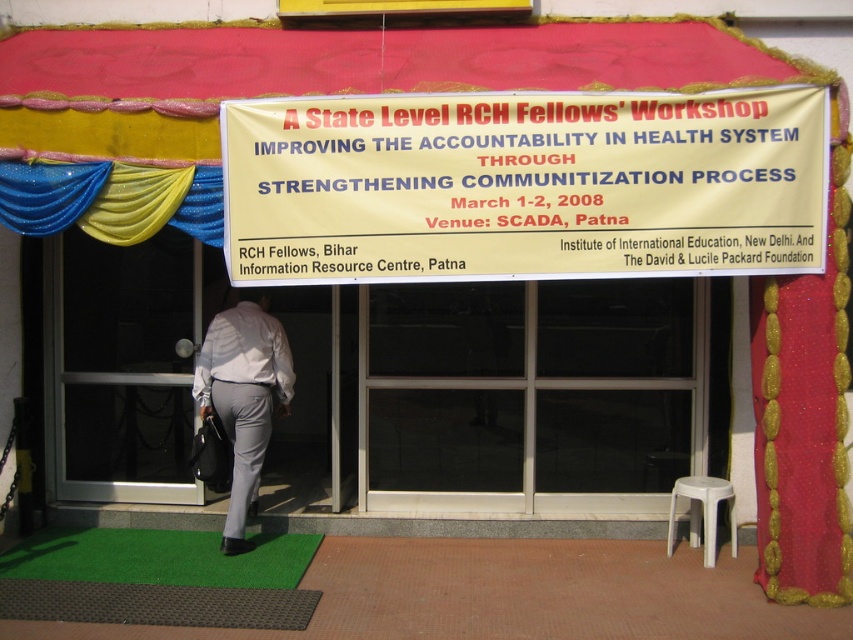
Based on the photo, you are a participant arriving at the venue for the workshop. You see the green artificial turf mat at lower center and the brown textured mat at lower center. Which mat should you step onto first as you approach the entrance?

You should step onto the green artificial turf mat at lower center first because it is closer to you than the brown textured mat at lower center, which is further away.